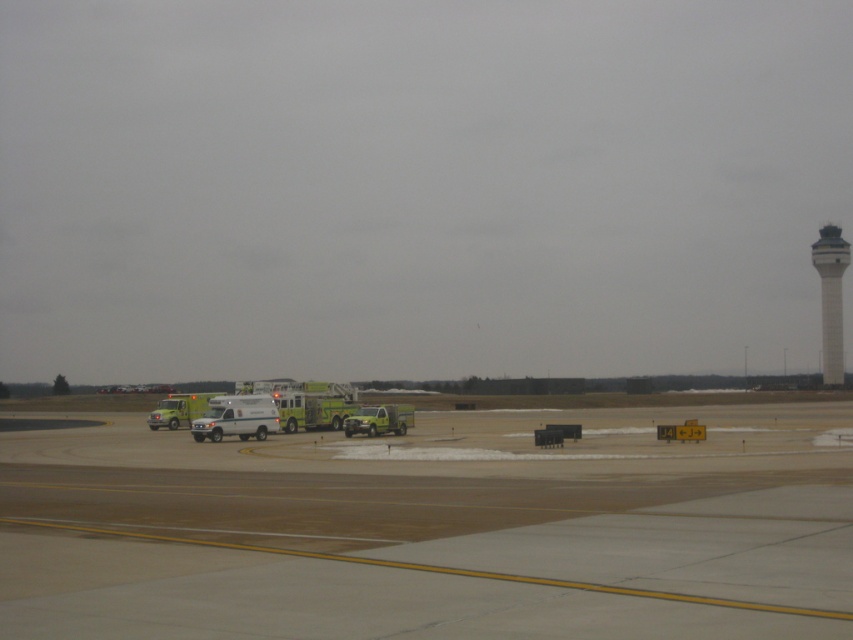
Question: From the image, what is the correct spatial relationship of white concrete control tower at upper right in relation to green matte fire truck at left?

Choices:
 (A) right
 (B) left

Answer: (A)

Question: Among these objects, which one is farthest from the camera?

Choices:
 (A) white matte van at center
 (B) green metallic fire truck at center

Answer: (B)

Question: Estimate the real-world distances between objects in this image. Which object is farther from the white matte van at center?

Choices:
 (A) green metallic fire truck at center
 (B) green matte truck at center

Answer: (A)

Question: Does smooth concrete tarmac at center appear over white matte van at center?

Choices:
 (A) yes
 (B) no

Answer: (A)

Question: Is smooth concrete tarmac at center thinner than green matte fire truck at left?

Choices:
 (A) no
 (B) yes

Answer: (A)

Question: Among these objects, which one is nearest to the camera?

Choices:
 (A) white matte van at center
 (B) green metallic fire truck at center

Answer: (A)